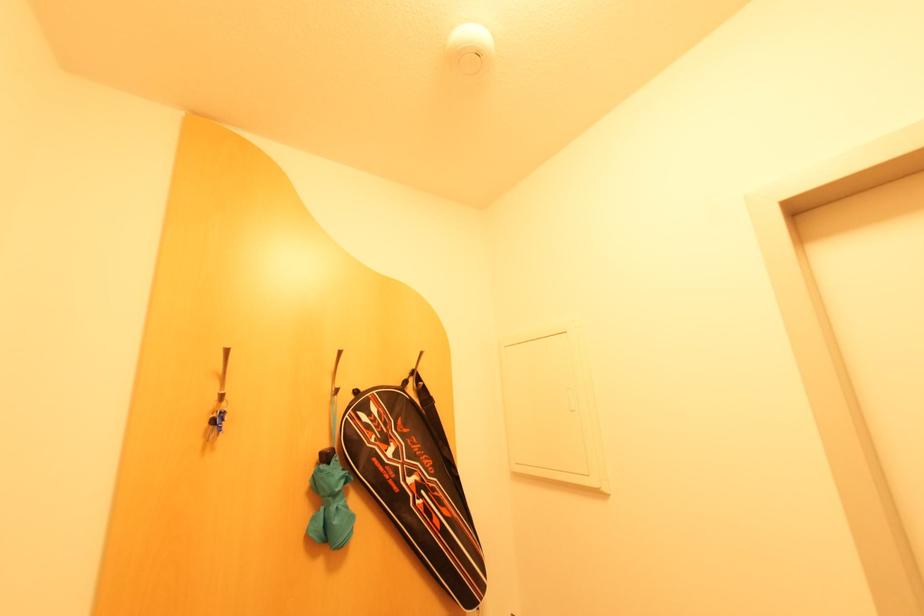
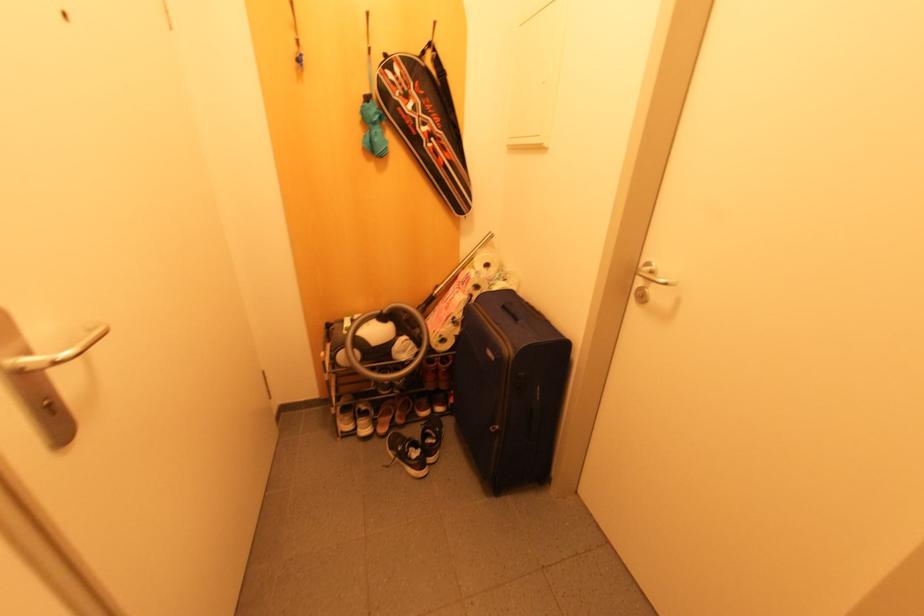
Find the pixel in the second image that matches point 371,439 in the first image.

(395, 94)